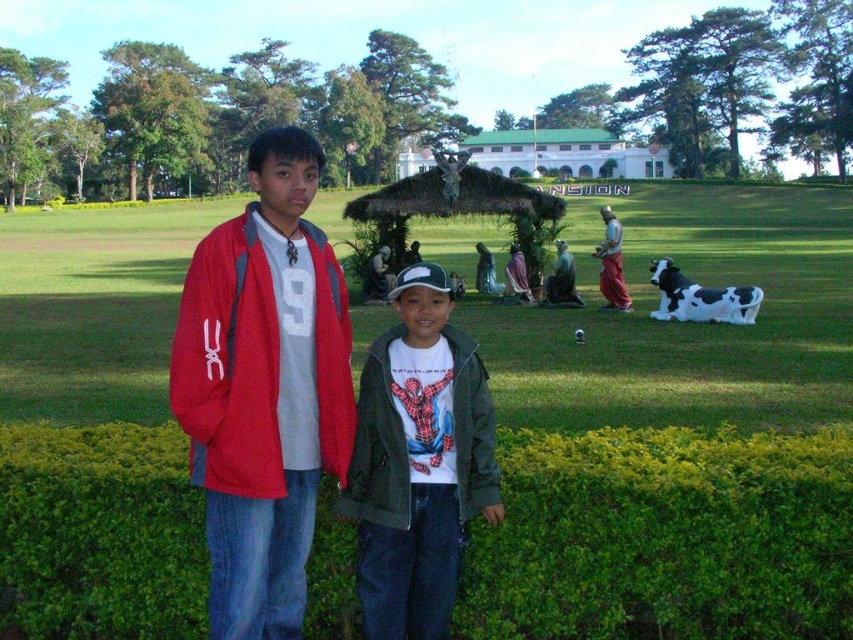
Question: Which point appears farthest from the camera in this image?

Choices:
 (A) (409, 275)
 (B) (804, 234)

Answer: (B)

Question: Does matte red jacket at left appear on the left side of green textured jacket at center?

Choices:
 (A) yes
 (B) no

Answer: (A)

Question: Among these points, which one is nearest to the camera?

Choices:
 (A) (599, 252)
 (B) (563, 248)
 (C) (370, 406)

Answer: (C)

Question: Among these objects, which one is nearest to the camera?

Choices:
 (A) matte red jacket at left
 (B) matte brown statue at center-right
 (C) matte red jacket at center
 (D) green textured jacket at center

Answer: (A)

Question: Is matte red jacket at left thinner than green marble statue at center?

Choices:
 (A) yes
 (B) no

Answer: (B)

Question: Does matte red jacket at left have a greater width compared to green textured jacket at center?

Choices:
 (A) yes
 (B) no

Answer: (A)